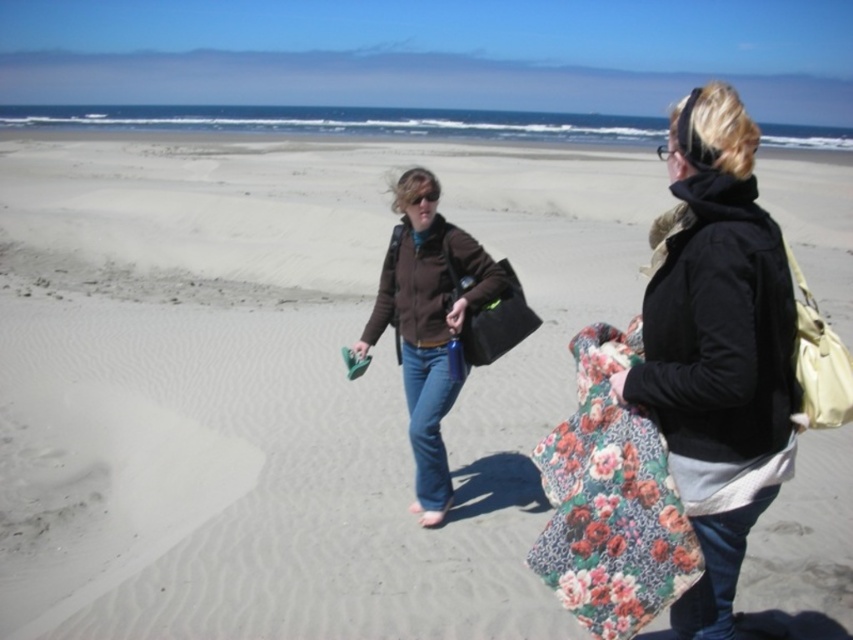
Does floral fabric blanket at center have a greater width compared to matte black bag at center?

Indeed, floral fabric blanket at center has a greater width compared to matte black bag at center.

Consider the image. Between floral fabric blanket at center and matte black bag at center, which one has more height?

floral fabric blanket at center

What do you see at coordinates (717, 346) in the screenshot?
I see `floral fabric blanket at center` at bounding box center [717, 346].

This screenshot has height=640, width=853. What are the coordinates of `floral fabric blanket at center` in the screenshot? It's located at (717, 346).

Does point (656, 492) lie in front of point (427, 312)?

Yes, it is.

The width and height of the screenshot is (853, 640). Identify the location of floral fabric shopping bag at right. (610, 500).

Which is in front, point (788, 356) or point (601, 624)?

Point (788, 356) is in front.

Does floral fabric blanket at center have a greater height compared to floral fabric shopping bag at right?

Indeed, floral fabric blanket at center has a greater height compared to floral fabric shopping bag at right.

Is point (651, 308) positioned behind point (589, 557)?

That is True.

The image size is (853, 640). I want to click on floral fabric blanket at center, so click(x=717, y=346).